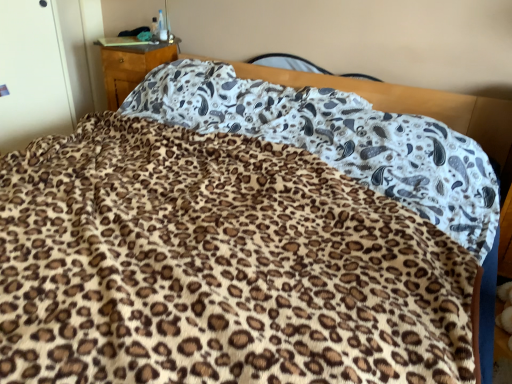
What are the coordinates of `wooden nightstand at upper left` in the screenshot? It's located at (131, 66).

What do you see at coordinates (131, 66) in the screenshot? The width and height of the screenshot is (512, 384). I see `wooden nightstand at upper left` at bounding box center [131, 66].

Image resolution: width=512 pixels, height=384 pixels. In order to click on wooden nightstand at upper left in this screenshot , I will do `click(131, 66)`.